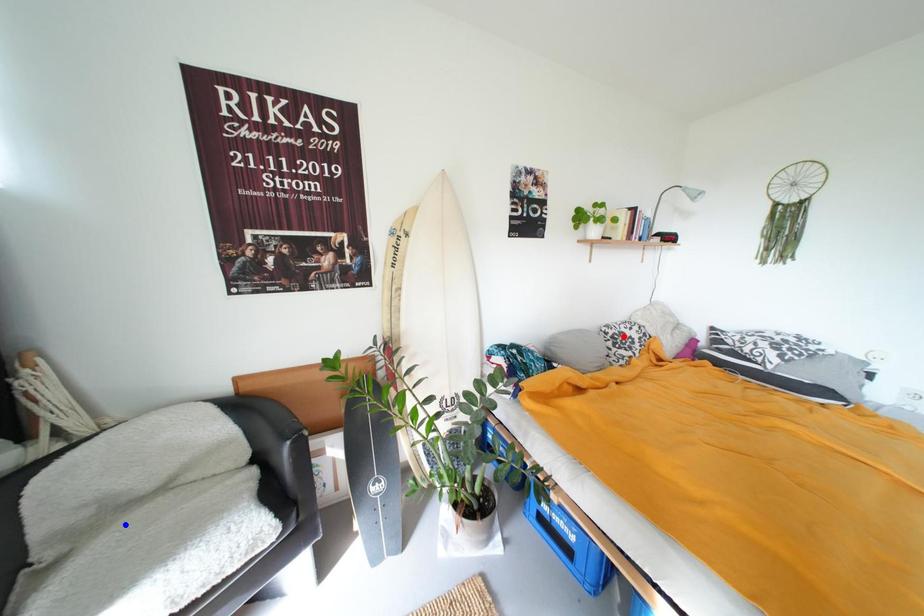
Question: In the image, two points are highlighted. Which point is nearer to the camera? Reply with the corresponding letter.

Choices:
 (A) blue point
 (B) red point

Answer: (A)